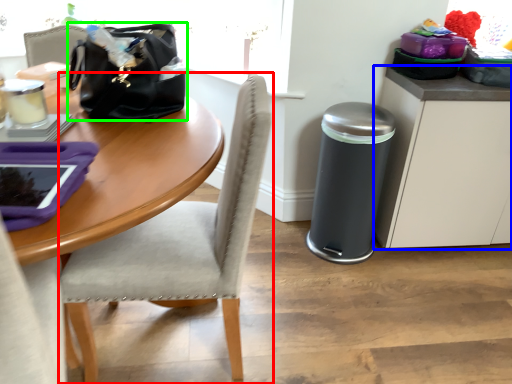
Question: Which object is positioned closest to chair (highlighted by a red box)? Select from cabinetry (highlighted by a blue box) and handbag (highlighted by a green box).

Choices:
 (A) cabinetry
 (B) handbag

Answer: (B)